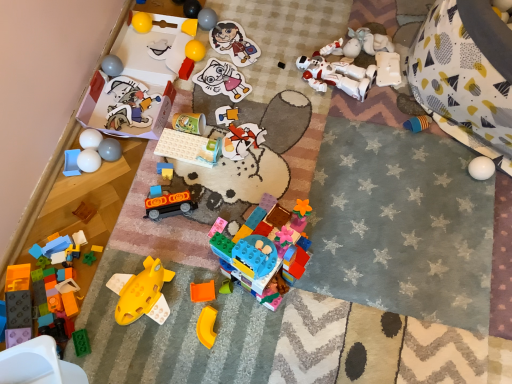
Where is `free space between matte plastic sticker at upper center, which is the 20th toy from left to right, and orange matte toy airplane at center, which is the eighth toy from right to left`? This screenshot has height=384, width=512. free space between matte plastic sticker at upper center, which is the 20th toy from left to right, and orange matte toy airplane at center, which is the eighth toy from right to left is located at coordinates (223, 141).